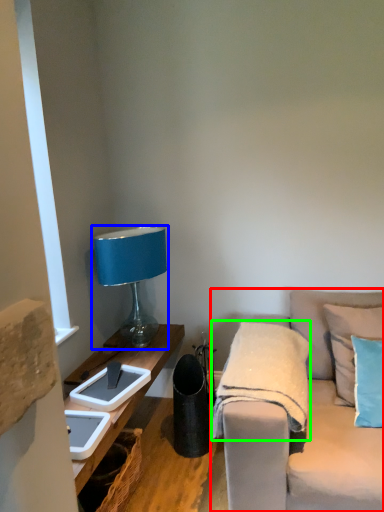
Question: Estimate the real-world distances between objects in this image. Which object is farther from studio couch (highlighted by a red box), lamp (highlighted by a blue box) or blanket (highlighted by a green box)?

Choices:
 (A) lamp
 (B) blanket

Answer: (A)